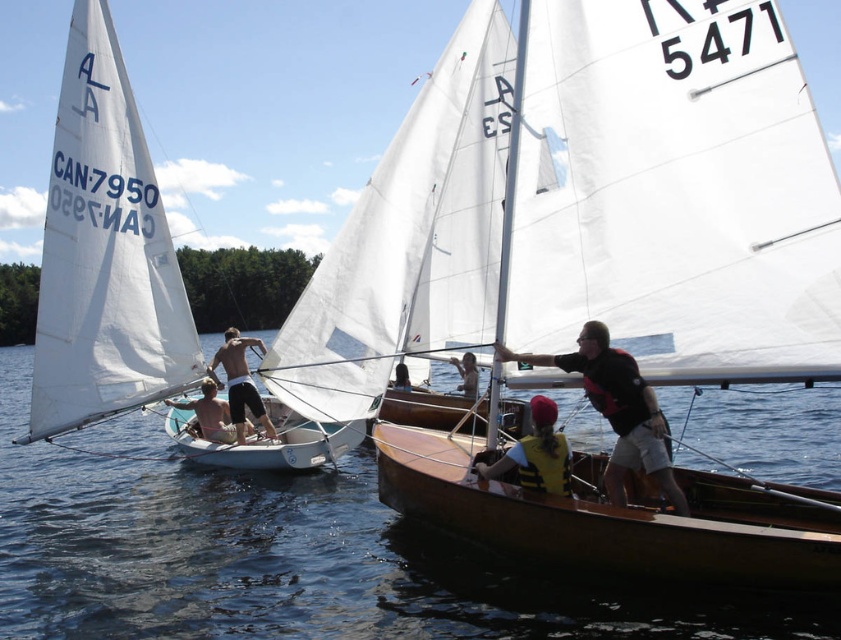
Which of these two, tan skin man at center or light brown wooden boat at center, stands taller?

tan skin man at center

Based on the photo, does tan skin man at center have a larger size compared to light brown wooden boat at center?

Yes.

Which is in front, point (182, 404) or point (471, 358)?

Point (182, 404) is more forward.

I want to click on tan skin man at center, so click(x=210, y=413).

Can you confirm if brown wood boat at center is positioned to the right of dark blue fabric shirt at center?

Indeed, brown wood boat at center is positioned on the right side of dark blue fabric shirt at center.

Is brown wood boat at center behind dark blue fabric shirt at center?

No, it is not.

Which is behind, point (688, 522) or point (405, 378)?

Point (405, 378)

Locate an element on the screen. The width and height of the screenshot is (841, 640). brown wood boat at center is located at coordinates (614, 516).

Who is positioned more to the right, transparent water at center or light brown wooden boat at center?

From the viewer's perspective, light brown wooden boat at center appears more on the right side.

Can you confirm if transparent water at center is positioned below light brown wooden boat at center?

Yes, transparent water at center is below light brown wooden boat at center.

The height and width of the screenshot is (640, 841). Find the location of `transparent water at center`. transparent water at center is located at coordinates (295, 560).